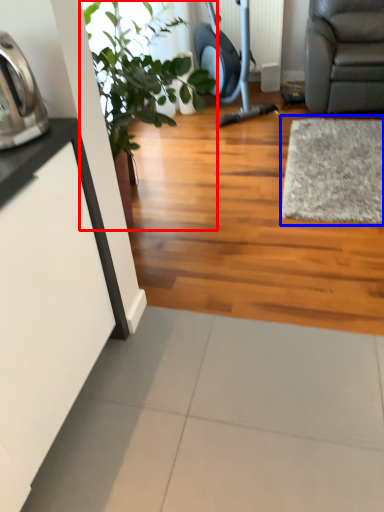
Question: Which object appears farthest to the camera in this image, houseplant (highlighted by a red box) or mat (highlighted by a blue box)?

Choices:
 (A) houseplant
 (B) mat

Answer: (B)